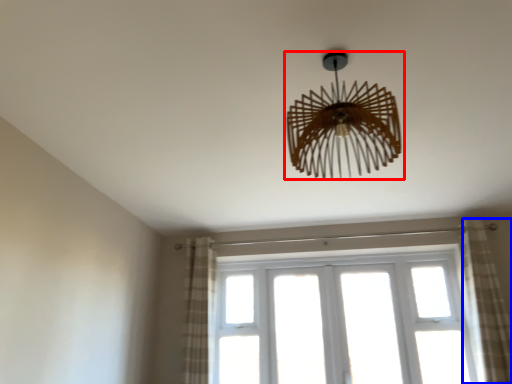
Question: Among these objects, which one is nearest to the camera, lamp (highlighted by a red box) or curtain (highlighted by a blue box)?

Choices:
 (A) lamp
 (B) curtain

Answer: (A)